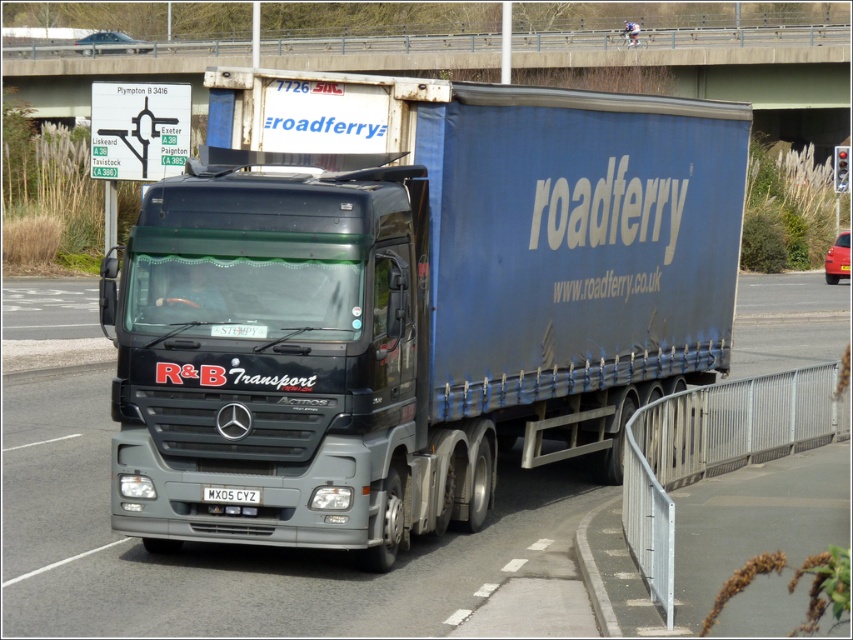
Question: Is the position of metallic blue trailer truck at center more distant than that of white rectangular license plate at center?

Choices:
 (A) yes
 (B) no

Answer: (B)

Question: Among these objects, which one is farthest from the camera?

Choices:
 (A) white rectangular license plate at center
 (B) metallic gray truck at center

Answer: (A)

Question: Can you confirm if metallic blue trailer truck at center is positioned to the right of white rectangular license plate at center?

Choices:
 (A) yes
 (B) no

Answer: (A)

Question: Is metallic blue trailer truck at center to the left of white rectangular license plate at center from the viewer's perspective?

Choices:
 (A) yes
 (B) no

Answer: (B)

Question: Which object is closer to the camera taking this photo?

Choices:
 (A) metallic blue trailer truck at center
 (B) white rectangular license plate at center
 (C) metallic gray truck at center

Answer: (C)

Question: Which is farther from the metallic blue trailer truck at center?

Choices:
 (A) metallic gray truck at center
 (B) white rectangular license plate at center

Answer: (B)